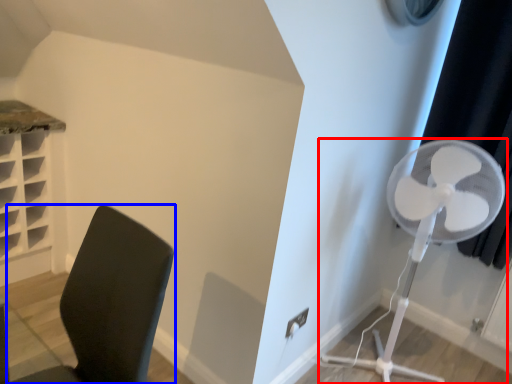
Question: Which point is closer to the camera, mechanical fan (highlighted by a red box) or furniture (highlighted by a blue box)?

Choices:
 (A) mechanical fan
 (B) furniture

Answer: (B)